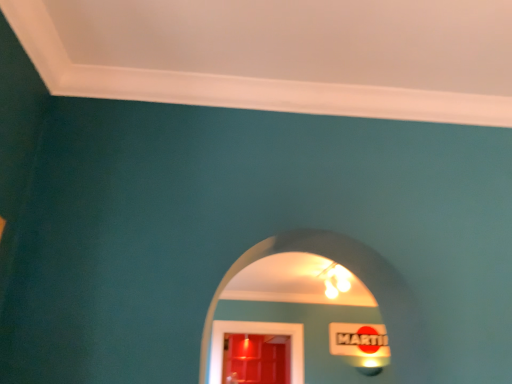
This screenshot has height=384, width=512. Describe the element at coordinates (339, 263) in the screenshot. I see `translucent glass window at upper center` at that location.

Identify the location of translucent glass window at upper center. (339, 263).

The width and height of the screenshot is (512, 384). In order to click on translucent glass window at upper center in this screenshot , I will do [x=339, y=263].